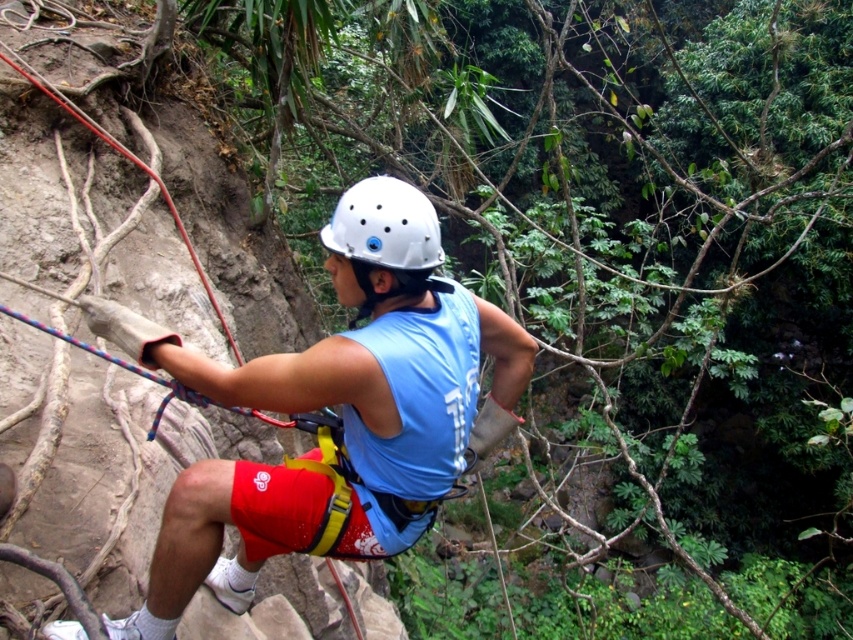
You are a photographer positioned at the base of the cliff, aiming to capture the climber in the image. The climber is wearing a matte blue tank top at center and a white matte helmet at center. Which piece of clothing should you focus on first to ensure it appears sharp in your photo?

The matte blue tank top at center is closer to the viewer than the white matte helmet at center, so focusing on the matte blue tank top at center first will ensure it appears sharp since it is in the foreground.

You are a drone operator trying to capture a closeup shot of the climber. You have two points marked in the image, point A at coordinates point (519, 330) and point B at coordinates point (387, 252). Which point is closer to the camera so you can focus there?

Point point (519, 330) is closer to the camera than point point (387, 252) because it is further to the viewer than the other point.